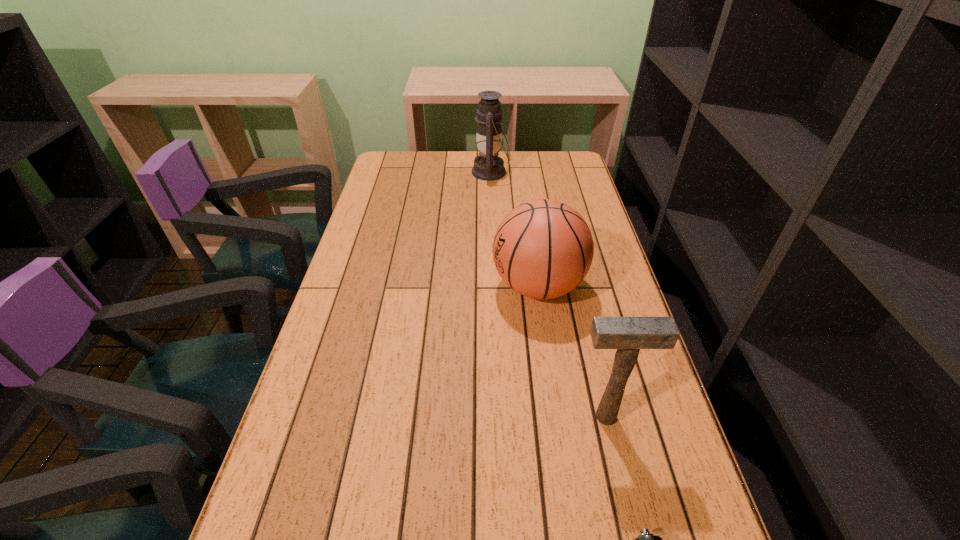
This screenshot has width=960, height=540. In order to click on the farthest object in this screenshot , I will do `click(488, 166)`.

Identify the location of the third farthest object. (628, 335).

Image resolution: width=960 pixels, height=540 pixels. I want to click on the third nearest object, so click(x=542, y=249).

You are a GUI agent. You are given a task and a screenshot of the screen. Output one action in this format:
    pyautogui.click(x=<x>, y=<y>)
    Task: Click on the free space located 0.360m on the left of the farthest object
    
    Given the screenshot: What is the action you would take?
    pyautogui.click(x=378, y=172)

Where is `free space located 0.180m on the back of the mallet`? The image size is (960, 540). free space located 0.180m on the back of the mallet is located at coordinates (588, 342).

This screenshot has width=960, height=540. What are the coordinates of `vacant region located 0.380m on the surface of the basketball near the brand logo` in the screenshot? It's located at (354, 286).

Find the location of `vacant space positioned 0.120m on the surface of the basketball near the brand logo`. vacant space positioned 0.120m on the surface of the basketball near the brand logo is located at coordinates [448, 286].

At what (x,y) coordinates should I click in order to perform the action: click on free space located on the surface of the basketball near the brand logo. Please return your answer as a coordinate pair (x, y). Looking at the image, I should click on (405, 286).

The image size is (960, 540). Find the location of `object positioned at the far edge`. object positioned at the far edge is located at coordinates (488, 166).

Identify the location of mallet located at the right edge. The height and width of the screenshot is (540, 960). (628, 335).